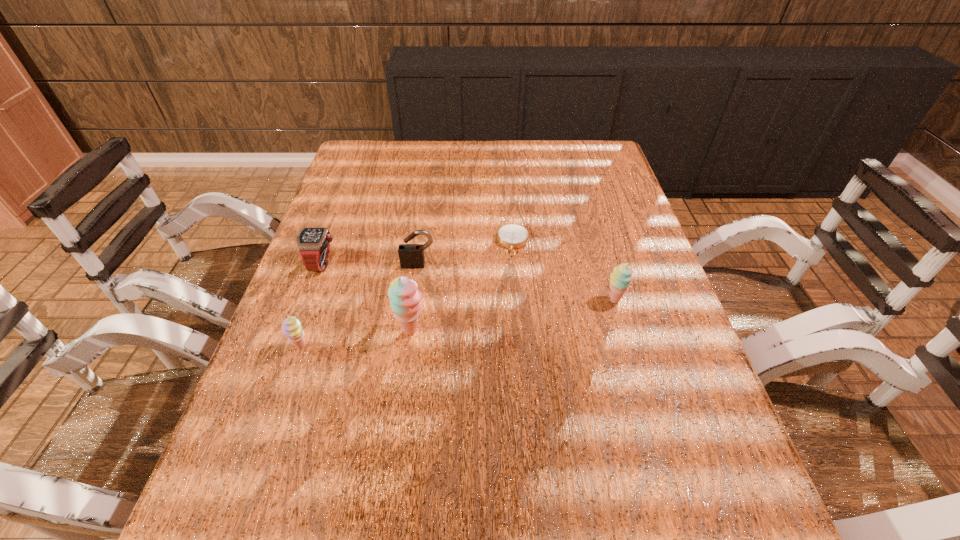
The height and width of the screenshot is (540, 960). Find the location of `vacant space that's between the watch and the padlock`. vacant space that's between the watch and the padlock is located at coordinates (371, 264).

The image size is (960, 540). What are the coordinates of `vacant area that lies between the second tallest sherbert and the padlock` in the screenshot? It's located at [516, 282].

I want to click on free spot between the tallest sherbert and the farthest sherbert, so click(x=513, y=315).

Locate an element on the screen. empty space between the shortest sherbert and the padlock is located at coordinates (359, 306).

Locate which object ranks fifth in proximity to the fifth object from left to right. Please provide its 2D coordinates. Your answer should be formatted as a tuple, i.e. [(x, y)], where the tuple contains the x and y coordinates of a point satisfying the conditions above.

[(291, 327)]

Locate an element on the screen. The width and height of the screenshot is (960, 540). the second closest object to the leftmost sherbert is located at coordinates (313, 244).

Identify the location of sherbert that can be found as the closest to the compass. pos(620,279).

Locate which sherbert ranks third in proximity to the watch. Please provide its 2D coordinates. Your answer should be formatted as a tuple, i.e. [(x, y)], where the tuple contains the x and y coordinates of a point satisfying the conditions above.

[(620, 279)]

I want to click on vacant space that satisfies the following two spatial constraints: 1. with the keyhole on the front of the padlock; 2. on the right side of the farthest sherbert, so click(414, 300).

The width and height of the screenshot is (960, 540). I want to click on free location that satisfies the following two spatial constraints: 1. on the back side of the fifth object from left to right; 2. on the left side of the leftmost sherbert, so click(337, 242).